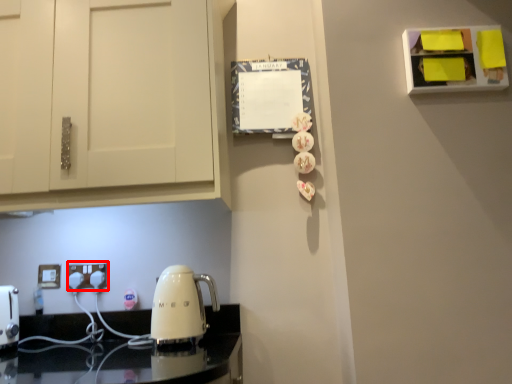
Question: From the image's perspective, where is electric outlet (annotated by the red box) located in relation to electric outlet in the image?

Choices:
 (A) above
 (B) below

Answer: (A)